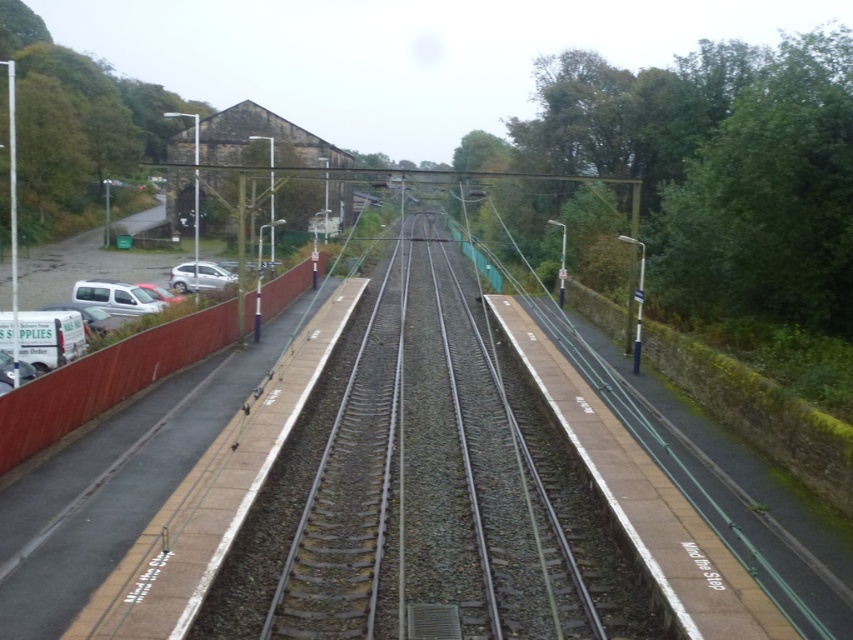
Is the position of smooth metal train track at center more distant than that of white matte van at left?

No, it is in front of white matte van at left.

Is point (387, 396) behind point (134, 307)?

No, it is not.

Describe the element at coordinates (430, 490) in the screenshot. The image size is (853, 640). I see `smooth metal train track at center` at that location.

Where is `smooth metal train track at center`? This screenshot has height=640, width=853. smooth metal train track at center is located at coordinates [430, 490].

What do you see at coordinates (115, 298) in the screenshot? I see `white matte van at left` at bounding box center [115, 298].

Which is behind, point (91, 288) or point (212, 280)?

Positioned behind is point (212, 280).

The width and height of the screenshot is (853, 640). I want to click on white matte van at left, so click(115, 298).

Locate an element on the screen. The height and width of the screenshot is (640, 853). smooth metal train track at center is located at coordinates (430, 490).

Does point (404, 440) come behind point (199, 273)?

No, it is not.

The height and width of the screenshot is (640, 853). I want to click on smooth metal train track at center, so click(430, 490).